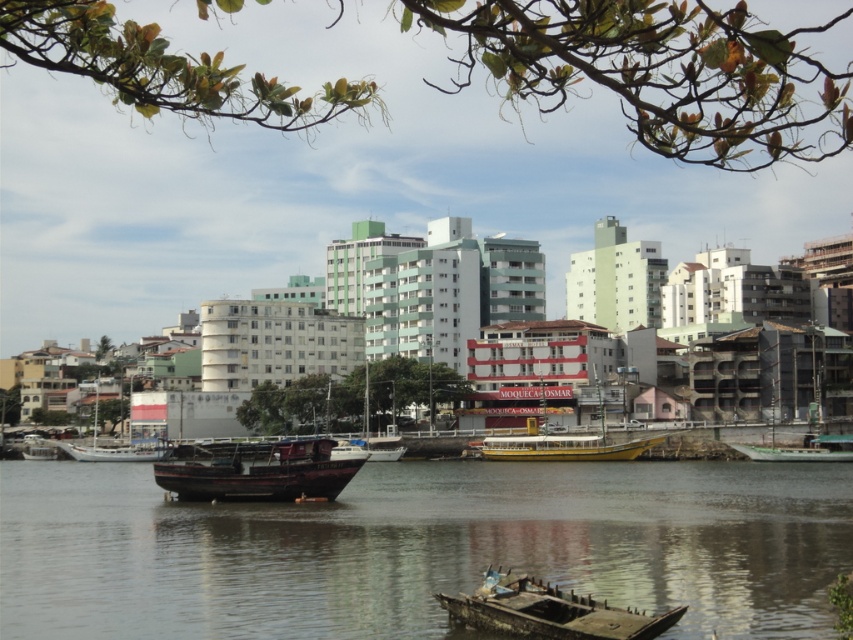
Can you confirm if green matte boat at right is positioned below wooden boat at center?

Incorrect, green matte boat at right is not positioned below wooden boat at center.

The height and width of the screenshot is (640, 853). What do you see at coordinates (802, 451) in the screenshot? I see `green matte boat at right` at bounding box center [802, 451].

The height and width of the screenshot is (640, 853). Find the location of `green matte boat at right`. green matte boat at right is located at coordinates (802, 451).

Does rusty metal boat at lower center lie in front of yellow matte boat at center?

Yes.

What do you see at coordinates (549, 611) in the screenshot? The height and width of the screenshot is (640, 853). I see `rusty metal boat at lower center` at bounding box center [549, 611].

Image resolution: width=853 pixels, height=640 pixels. In order to click on rusty metal boat at lower center in this screenshot , I will do 549,611.

Identify the location of rusty metal boat at lower center. This screenshot has height=640, width=853. (549, 611).

Which is in front, point (252, 486) or point (664, 624)?

Point (664, 624)

Is point (361, 460) closer to viewer compared to point (560, 611)?

That is False.

Is point (280, 500) more distant than point (544, 625)?

Yes, point (280, 500) is behind point (544, 625).

Find the location of `rusty wood boat at center`. rusty wood boat at center is located at coordinates (259, 472).